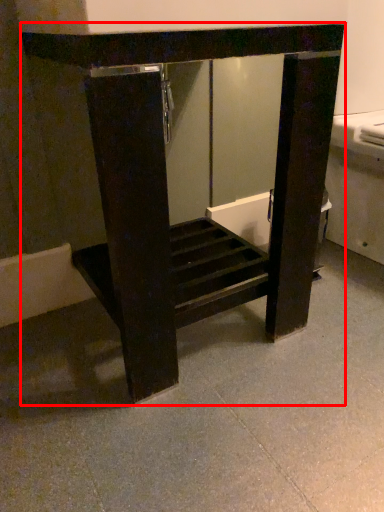
Question: From the image's perspective, what is the correct spatial positioning of furniture (annotated by the red box) in reference to concrete?

Choices:
 (A) below
 (B) above

Answer: (B)